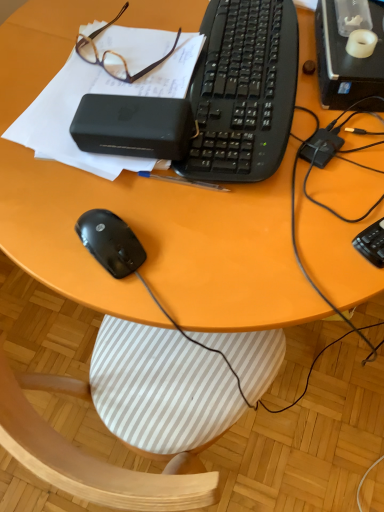
The width and height of the screenshot is (384, 512). I want to click on brown plastic glasses at upper left, so click(113, 54).

This screenshot has width=384, height=512. What do you see at coordinates (110, 242) in the screenshot?
I see `black matte mouse at lower left` at bounding box center [110, 242].

Where is `black plastic keyboard at center, the 2th computer keyboard from the right`? The width and height of the screenshot is (384, 512). black plastic keyboard at center, the 2th computer keyboard from the right is located at coordinates (243, 91).

Looking at this image, considering the relative sizes of black matte mouse at lower left and black plastic keyboard at center, the 2th computer keyboard positioned from the bottom, in the image provided, is black matte mouse at lower left bigger than black plastic keyboard at center, the 2th computer keyboard positioned from the bottom,?

No, black matte mouse at lower left is not bigger than black plastic keyboard at center, the 2th computer keyboard positioned from the bottom.

Measure the distance from black matte mouse at lower left to black plastic keyboard at center, the 2th computer keyboard positioned from the bottom.

black matte mouse at lower left is 30.42 centimeters from black plastic keyboard at center, the 2th computer keyboard positioned from the bottom.

Which is in front, point (85, 230) or point (238, 156)?

The point (85, 230) is in front.

Consider the image. Considering the relative positions of black matte mouse at lower left and black plastic keyboard at center, acting as the 1th computer keyboard starting from the left, in the image provided, is black matte mouse at lower left to the left or to the right of black plastic keyboard at center, acting as the 1th computer keyboard starting from the left,?

Based on their positions, black matte mouse at lower left is located to the left of black plastic keyboard at center, acting as the 1th computer keyboard starting from the left.

This screenshot has height=512, width=384. Find the location of `notepad above the black plastic keyboard at right, the first computer keyboard positioned from the bottom (from a real-world perspective)`. notepad above the black plastic keyboard at right, the first computer keyboard positioned from the bottom (from a real-world perspective) is located at coordinates (97, 93).

Is black plastic keyboard at right, the first computer keyboard positioned from the bottom, taller than black matte notepad at upper left?

Incorrect, the height of black plastic keyboard at right, the first computer keyboard positioned from the bottom, is not larger of that of black matte notepad at upper left.

Which is in front, point (360, 237) or point (72, 161)?

Point (360, 237)

Based on their sizes in the image, would you say black plastic keyboard at right, which is the second computer keyboard from left to right, is bigger or smaller than black matte notepad at upper left?

Clearly, black plastic keyboard at right, which is the second computer keyboard from left to right, is smaller in size than black matte notepad at upper left.

Consider the image. From a real-world perspective, does black plastic desktop computer at upper right sit lower than black matte notepad at upper left?

No, from a real-world perspective, black plastic desktop computer at upper right is not beneath black matte notepad at upper left.

Between black plastic desktop computer at upper right and black matte notepad at upper left, which one has larger size?

black plastic desktop computer at upper right is bigger.

Is the position of black plastic desktop computer at upper right less distant than that of black matte notepad at upper left?

No, the depth of black plastic desktop computer at upper right is greater than that of black matte notepad at upper left.

Is black plastic power bank at upper center next to brown plastic glasses at upper left?

No, black plastic power bank at upper center is not in contact with brown plastic glasses at upper left.

Based on the photo, from a real-world perspective, is black plastic power bank at upper center below brown plastic glasses at upper left?

No, from a real-world perspective, black plastic power bank at upper center is not beneath brown plastic glasses at upper left.

Which object is wider, black plastic power bank at upper center or brown plastic glasses at upper left?

Wider between the two is brown plastic glasses at upper left.

Is black plastic power bank at upper center at the right side of brown plastic glasses at upper left?

Correct, you'll find black plastic power bank at upper center to the right of brown plastic glasses at upper left.

Is black plastic desktop computer at upper right at the left side of black plastic keyboard at center, the 2th computer keyboard positioned from the bottom?

Incorrect, black plastic desktop computer at upper right is not on the left side of black plastic keyboard at center, the 2th computer keyboard positioned from the bottom.

Find the location of a particular element. desktop computer above the black plastic keyboard at center, the first computer keyboard viewed from the top (from a real-world perspective) is located at coordinates (346, 60).

Does black plastic desktop computer at upper right have a lesser width compared to black plastic keyboard at center, the 2th computer keyboard positioned from the bottom?

In fact, black plastic desktop computer at upper right might be wider than black plastic keyboard at center, the 2th computer keyboard positioned from the bottom.

Between black plastic desktop computer at upper right and black plastic keyboard at center, the 2th computer keyboard from the right, which one has larger size?

black plastic desktop computer at upper right is bigger.

Is black plastic power bank at upper center positioned far away from black matte notepad at upper left?

No, black plastic power bank at upper center is in close proximity to black matte notepad at upper left.

Where is `gadget in front of the black matte notepad at upper left`? gadget in front of the black matte notepad at upper left is located at coordinates (134, 126).

Looking at this image, from a real-world perspective, does black plastic power bank at upper center stand above black matte notepad at upper left?

Yes, from a real-world perspective, black plastic power bank at upper center is over black matte notepad at upper left

Looking at the image, does black plastic power bank at upper center seem bigger or smaller compared to black matte notepad at upper left?

Clearly, black plastic power bank at upper center is smaller in size than black matte notepad at upper left.

Based on the photo, how many degrees apart are the facing directions of black plastic power bank at upper center and black plastic desktop computer at upper right?

The angular difference between black plastic power bank at upper center and black plastic desktop computer at upper right is 83 degrees.

Would you say black plastic power bank at upper center is a long distance from black plastic desktop computer at upper right?

No, black plastic power bank at upper center is not far from black plastic desktop computer at upper right.

Is black plastic power bank at upper center bigger or smaller than black plastic desktop computer at upper right?

Clearly, black plastic power bank at upper center is smaller in size than black plastic desktop computer at upper right.

Which computer keyboard is the 1st one when counting from the right side of the black matte mouse at lower left? Please provide its 2D coordinates.

[(243, 91)]

Find the location of a particular element. computer keyboard below the black matte notepad at upper left (from the image's perspective) is located at coordinates (372, 243).

From the image, which object appears to be nearer to black plastic power bank at upper center, black matte mouse at lower left or black plastic keyboard at right, which ranks as the second computer keyboard in top-to-bottom order?

The object closer to black plastic power bank at upper center is black matte mouse at lower left.

When comparing their distances from black plastic power bank at upper center, does black plastic keyboard at right, placed as the second computer keyboard when sorted from back to front, or black matte mouse at lower left seem closer?

black matte mouse at lower left is positioned closer to the anchor black plastic power bank at upper center.

When comparing their distances from black plastic desktop computer at upper right, does black plastic keyboard at right, placed as the second computer keyboard when sorted from back to front, or black matte notepad at upper left seem further?

black matte notepad at upper left is positioned further to the anchor black plastic desktop computer at upper right.

Which object lies nearer to the anchor point brown plastic glasses at upper left, black plastic keyboard at right, the 1th computer keyboard in the right-to-left sequence, or black plastic keyboard at center, the 2th computer keyboard from the right?

black plastic keyboard at center, the 2th computer keyboard from the right, lies closer to brown plastic glasses at upper left than the other object.

Looking at the image, which one is located further to black plastic power bank at upper center, black matte notepad at upper left or brown plastic glasses at upper left?

The object further to black plastic power bank at upper center is brown plastic glasses at upper left.

Estimate the real-world distances between objects in this image. Which object is closer to black plastic desktop computer at upper right, brown plastic glasses at upper left or black matte notepad at upper left?

brown plastic glasses at upper left is positioned closer to the anchor black plastic desktop computer at upper right.

Considering their positions, is black plastic keyboard at center, acting as the 1th computer keyboard starting from the left, positioned further to black plastic desktop computer at upper right than black matte notepad at upper left?

Based on the image, black matte notepad at upper left appears to be further to black plastic desktop computer at upper right.

Considering their positions, is black plastic keyboard at center, acting as the 1th computer keyboard starting from the left, positioned closer to black plastic desktop computer at upper right than black plastic power bank at upper center?

black plastic keyboard at center, acting as the 1th computer keyboard starting from the left, is closer to black plastic desktop computer at upper right.

Where is `computer keyboard situated between black plastic power bank at upper center and black plastic keyboard at right, which is the second computer keyboard from left to right, from left to right`? This screenshot has height=512, width=384. computer keyboard situated between black plastic power bank at upper center and black plastic keyboard at right, which is the second computer keyboard from left to right, from left to right is located at coordinates (243, 91).

You are a GUI agent. You are given a task and a screenshot of the screen. Output one action in this format:
    pyautogui.click(x=<x>, y=<y>)
    Task: Click on the gadget between brown plastic glasses at upper left and black plastic desktop computer at upper right from left to right
    This screenshot has width=384, height=512.
    Given the screenshot: What is the action you would take?
    pyautogui.click(x=134, y=126)

The image size is (384, 512). In order to click on computer keyboard situated between brown plastic glasses at upper left and black plastic keyboard at right, the first computer keyboard positioned from the bottom, from left to right in this screenshot , I will do click(243, 91).

The image size is (384, 512). I want to click on notepad between brown plastic glasses at upper left and black plastic power bank at upper center in the up-down direction, so (x=97, y=93).